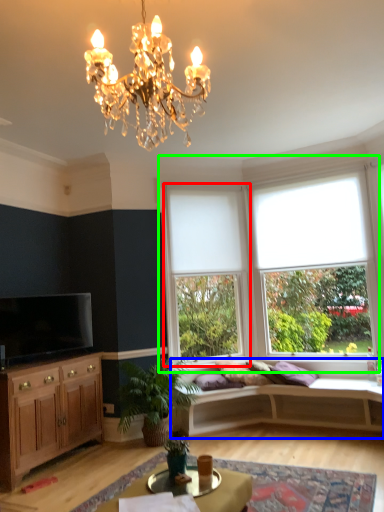
Question: Which object is the closest to the window (highlighted by a red box)? Choose among these: studio couch (highlighted by a blue box) or window (highlighted by a green box).

Choices:
 (A) studio couch
 (B) window

Answer: (B)